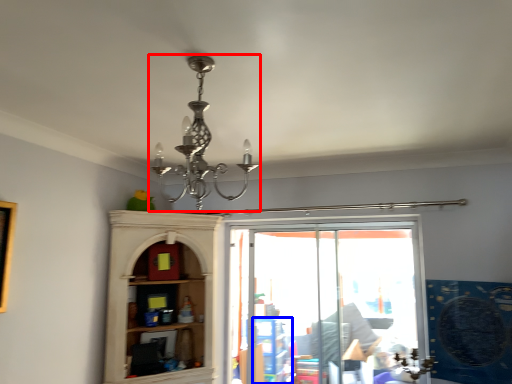
Question: Which object is further to the camera taking this photo, lamp (highlighted by a red box) or shelf (highlighted by a blue box)?

Choices:
 (A) lamp
 (B) shelf

Answer: (B)